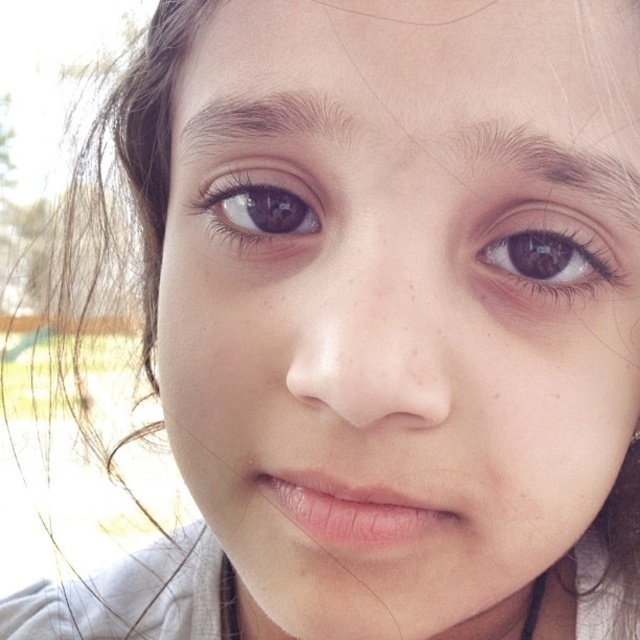
Question: Does brown matte eye at upper left appear on the right side of dark brown hair at upper center?

Choices:
 (A) no
 (B) yes

Answer: (B)

Question: Which object is closer to the camera taking this photo?

Choices:
 (A) dark brown hair at upper center
 (B) brown matte eye at upper right
 (C) dark brown hair at upper right
 (D) brown matte eye at upper left

Answer: (C)

Question: Estimate the real-world distances between objects in this image. Which object is farther from the brown matte eye at upper right?

Choices:
 (A) dark brown hair at upper right
 (B) brown matte eye at upper left
 (C) dark brown hair at upper center

Answer: (B)

Question: Is brown matte eye at upper right smaller than brown matte eye at upper left?

Choices:
 (A) yes
 (B) no

Answer: (A)

Question: Which of the following is the farthest from the observer?

Choices:
 (A) (262, 180)
 (B) (483, 252)
 (C) (259, 104)

Answer: (A)

Question: Is brown matte eye at upper right wider than dark brown hair at upper right?

Choices:
 (A) yes
 (B) no

Answer: (B)